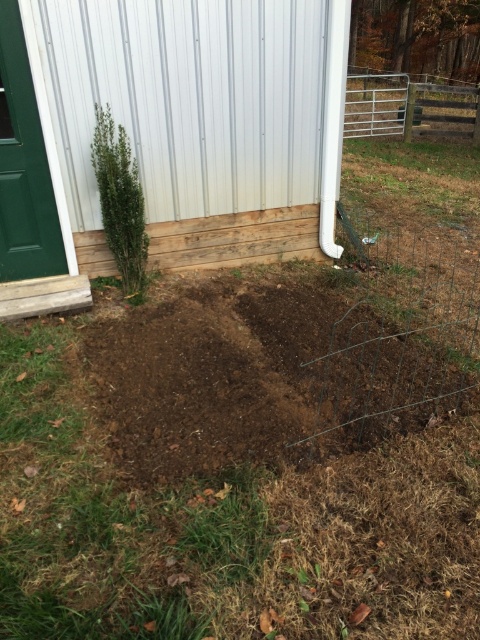
Does dark brown soil at center appear on the right side of green leafy plant at left?

Yes, dark brown soil at center is to the right of green leafy plant at left.

Between dark brown soil at center and green leafy plant at left, which one appears on the right side from the viewer's perspective?

From the viewer's perspective, dark brown soil at center appears more on the right side.

Where is `dark brown soil at center`? The width and height of the screenshot is (480, 640). dark brown soil at center is located at coordinates (213, 369).

Find the location of `dark brown soil at center`. dark brown soil at center is located at coordinates [x=213, y=369].

Between dark brown soil at center and white metal gate at upper right, which one is positioned higher?

Positioned higher is white metal gate at upper right.

Can you confirm if dark brown soil at center is positioned to the right of white metal gate at upper right?

No, dark brown soil at center is not to the right of white metal gate at upper right.

Locate an element on the screen. The height and width of the screenshot is (640, 480). dark brown soil at center is located at coordinates (213, 369).

This screenshot has height=640, width=480. What do you see at coordinates (408, 108) in the screenshot? I see `white metal gate at upper right` at bounding box center [408, 108].

From the picture: Is white metal gate at upper right wider than green leafy plant at left?

Indeed, white metal gate at upper right has a greater width compared to green leafy plant at left.

Which is behind, point (369, 104) or point (133, 161)?

Positioned behind is point (369, 104).

Where is `white metal gate at upper right`? Image resolution: width=480 pixels, height=640 pixels. white metal gate at upper right is located at coordinates (408, 108).